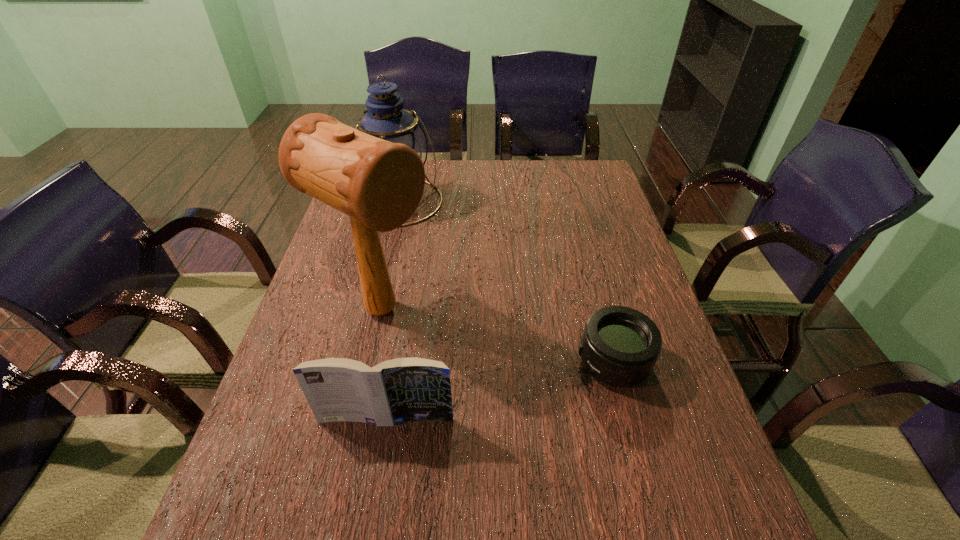
Identify the location of book. The height and width of the screenshot is (540, 960). (400, 390).

Identify the location of the nearest object. (400, 390).

Find the location of a particular element. telephoto lens is located at coordinates pyautogui.click(x=620, y=346).

Locate an element on the screen. The image size is (960, 540). the rightmost object is located at coordinates (620, 346).

Find the location of a particular element. This screenshot has height=540, width=960. the second tallest object is located at coordinates (386, 119).

Where is `lantern`? The width and height of the screenshot is (960, 540). lantern is located at coordinates (386, 119).

Find the location of a particular element. This screenshot has height=540, width=960. mallet is located at coordinates (379, 184).

Identify the location of vacant space situated 0.060m on the front cover of the second shortest object. This screenshot has height=540, width=960. (380, 456).

In order to click on vacant region located on the side of the shortest object with brand markings and control switches in this screenshot , I will do [450, 362].

At what (x,y) coordinates should I click in order to perform the action: click on free space located 0.120m on the side of the shortest object with brand markings and control switches. Please return your answer as a coordinate pair (x, y). Looking at the image, I should click on (524, 362).